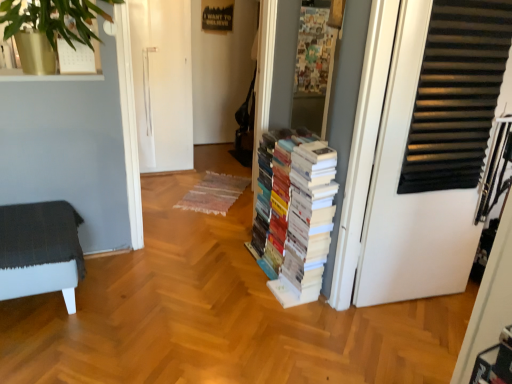
Question: Considering the relative sizes of white paper books at center and white matte door at right in the image provided, is white paper books at center taller than white matte door at right?

Choices:
 (A) no
 (B) yes

Answer: (A)

Question: Is white paper books at center smaller than white matte door at right?

Choices:
 (A) yes
 (B) no

Answer: (B)

Question: Does white paper books at center appear on the right side of white matte door at right?

Choices:
 (A) yes
 (B) no

Answer: (B)

Question: Can you confirm if white paper books at center is thinner than white matte door at right?

Choices:
 (A) yes
 (B) no

Answer: (B)

Question: Is white paper books at center oriented towards white matte door at right?

Choices:
 (A) yes
 (B) no

Answer: (B)

Question: Considering the positions of white paper books at center and dark gray fabric ottoman at left in the image, is white paper books at center bigger or smaller than dark gray fabric ottoman at left?

Choices:
 (A) big
 (B) small

Answer: (A)

Question: Is point (296, 195) closer or farther from the camera than point (72, 254)?

Choices:
 (A) closer
 (B) farther

Answer: (B)

Question: Considering the relative positions of white paper books at center and dark gray fabric ottoman at left in the image provided, is white paper books at center to the left or to the right of dark gray fabric ottoman at left?

Choices:
 (A) right
 (B) left

Answer: (A)

Question: Considering their positions, is white paper books at center located in front of or behind dark gray fabric ottoman at left?

Choices:
 (A) front
 (B) behind

Answer: (B)

Question: Is white paper books at center in front of or behind white matte door at right in the image?

Choices:
 (A) behind
 (B) front

Answer: (A)

Question: Considering the relative positions of white paper books at center and white matte door at right in the image provided, is white paper books at center to the left or to the right of white matte door at right?

Choices:
 (A) left
 (B) right

Answer: (A)

Question: Is point (309, 195) positioned closer to the camera than point (416, 235)?

Choices:
 (A) farther
 (B) closer

Answer: (B)

Question: Is white paper books at center wider or thinner than white matte door at right?

Choices:
 (A) thin
 (B) wide

Answer: (B)

Question: In terms of width, does dark gray fabric ottoman at left look wider or thinner when compared to white paper books at center?

Choices:
 (A) wide
 (B) thin

Answer: (A)

Question: Is dark gray fabric ottoman at left in front of or behind white paper books at center in the image?

Choices:
 (A) behind
 (B) front

Answer: (B)